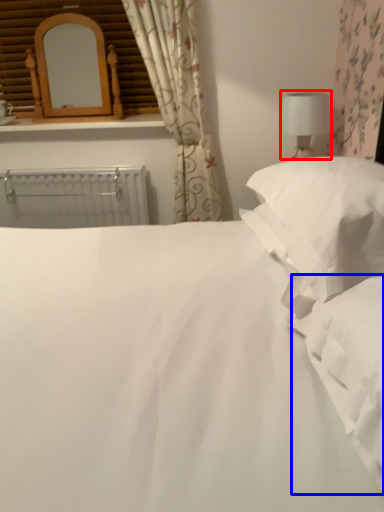
Question: Which of the following is the closest to the observer, table lamp (highlighted by a red box) or sheet (highlighted by a blue box)?

Choices:
 (A) table lamp
 (B) sheet

Answer: (B)